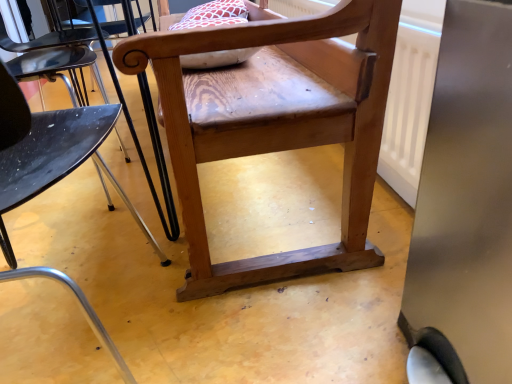
Question: Is natural wood chair at center, the 1th chair viewed from the back, completely or partially outside of wooden chair at center, arranged as the 1th chair when viewed from the front?

Choices:
 (A) yes
 (B) no

Answer: (A)

Question: From a real-world perspective, does natural wood chair at center, the 1th chair viewed from the back, stand above wooden chair at center, which appears as the 2th chair when viewed from the back?

Choices:
 (A) yes
 (B) no

Answer: (B)

Question: From the image's perspective, is natural wood chair at center, the 1th chair viewed from the back, located beneath wooden chair at center, arranged as the 1th chair when viewed from the front?

Choices:
 (A) yes
 (B) no

Answer: (B)

Question: Is natural wood chair at center, arranged as the second chair when viewed from the front, smaller than wooden chair at center, arranged as the 1th chair when viewed from the front?

Choices:
 (A) no
 (B) yes

Answer: (A)

Question: From the image's perspective, is natural wood chair at center, the 1th chair viewed from the back, on wooden chair at center, arranged as the 1th chair when viewed from the front?

Choices:
 (A) no
 (B) yes

Answer: (B)

Question: Does natural wood chair at center, the 1th chair viewed from the back, turn towards wooden chair at center, which appears as the 2th chair when viewed from the back?

Choices:
 (A) no
 (B) yes

Answer: (B)

Question: Can you confirm if wooden chair at center, arranged as the 1th chair when viewed from the front, is positioned to the left of natural wood chair at center, arranged as the second chair when viewed from the front?

Choices:
 (A) no
 (B) yes

Answer: (B)

Question: Can you confirm if wooden chair at center, which appears as the 2th chair when viewed from the back, is taller than natural wood chair at center, the 1th chair viewed from the back?

Choices:
 (A) yes
 (B) no

Answer: (A)

Question: Is natural wood chair at center, arranged as the second chair when viewed from the front, at the back of wooden chair at center, which appears as the 2th chair when viewed from the back?

Choices:
 (A) yes
 (B) no

Answer: (B)

Question: Is wooden chair at center, arranged as the 1th chair when viewed from the front, wider than natural wood chair at center, the 1th chair viewed from the back?

Choices:
 (A) yes
 (B) no

Answer: (B)

Question: From a real-world perspective, is wooden chair at center, arranged as the 1th chair when viewed from the front, located beneath natural wood chair at center, arranged as the second chair when viewed from the front?

Choices:
 (A) yes
 (B) no

Answer: (B)

Question: Is wooden chair at center, arranged as the 1th chair when viewed from the front, smaller than natural wood chair at center, the 1th chair viewed from the back?

Choices:
 (A) no
 (B) yes

Answer: (B)

Question: Relative to wooden chair at center, which appears as the 2th chair when viewed from the back, is natural wood chair at center, arranged as the second chair when viewed from the front, in front or behind?

Choices:
 (A) front
 (B) behind

Answer: (B)